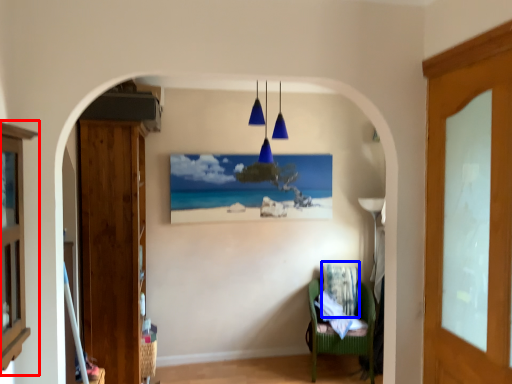
Question: Which object is closer to the camera taking this photo, cabinetry (highlighted by a red box) or pillow (highlighted by a blue box)?

Choices:
 (A) cabinetry
 (B) pillow

Answer: (A)